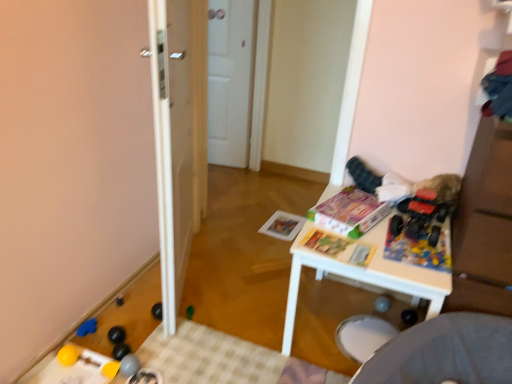
Question: From a real-world perspective, is white plastic table at center positioned above or below white glossy door at center?

Choices:
 (A) below
 (B) above

Answer: (A)

Question: Considering the positions of point (321, 273) and point (159, 44), is point (321, 273) closer or farther from the camera than point (159, 44)?

Choices:
 (A) farther
 (B) closer

Answer: (A)

Question: Based on their relative distances, which object is nearer to the white glossy door at center?

Choices:
 (A) rubberized plastic toy at center right, which is the 6th toy from bottom to top
 (B) rubber yellow ball at lower left, positioned as the 1th toy in left-to-right order
 (C) rubber yellow ball at lower left, arranged as the sixth toy when viewed from the top
 (D) white plastic table at center
 (E) green plastic toy at center, which is counted as the second toy, starting from the top

Answer: (D)

Question: Based on their relative distances, which object is nearer to the matte paper magazine at center, positioned as the third magazine in front-to-back order?

Choices:
 (A) rubber yellow ball at lower left, which is the third toy from bottom to top
 (B) rubber yellow ball at lower left, which is counted as the 1th toy, starting from the bottom
 (C) white glossy door at center
 (D) rubberized gray ball at lower left, which is the 4th toy from left to right
 (E) matte cardboard magazine at center, placed as the 2th magazine when sorted from back to front

Answer: (E)